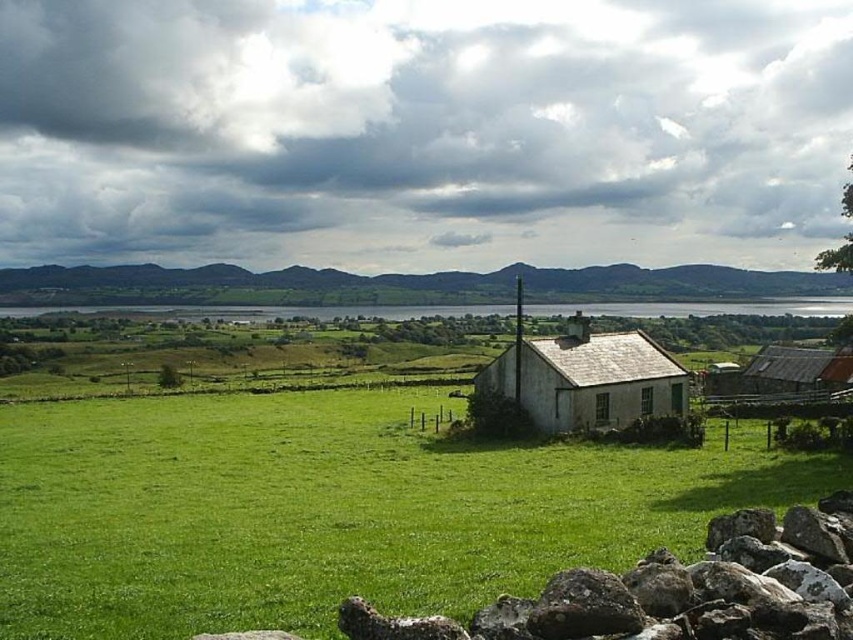
You are planning to place a small garden between the rough textured rock at lower right and the white textured house at center. Which object should you place the garden closer to if you want it to be near the larger structure?

The white textured house at center is larger than the rough textured rock at lower right, so you should place the garden closer to the white textured house at center to be near the larger structure.